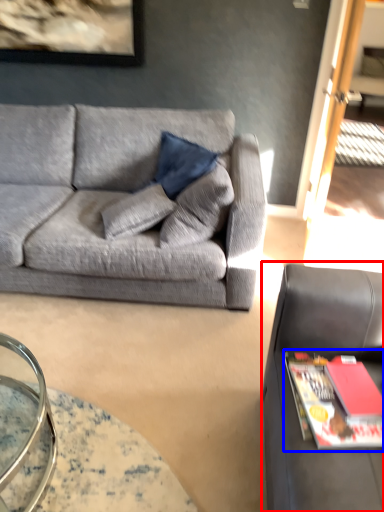
Question: Which of the following is the farthest to the observer, studio couch (highlighted by a red box) or magazine (highlighted by a blue box)?

Choices:
 (A) studio couch
 (B) magazine

Answer: (B)